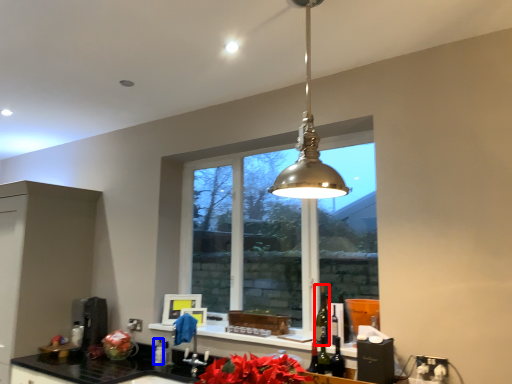
Question: Which of the following is the farthest to the observer, alcohol (highlighted by a red box) or bottle (highlighted by a blue box)?

Choices:
 (A) alcohol
 (B) bottle

Answer: (B)